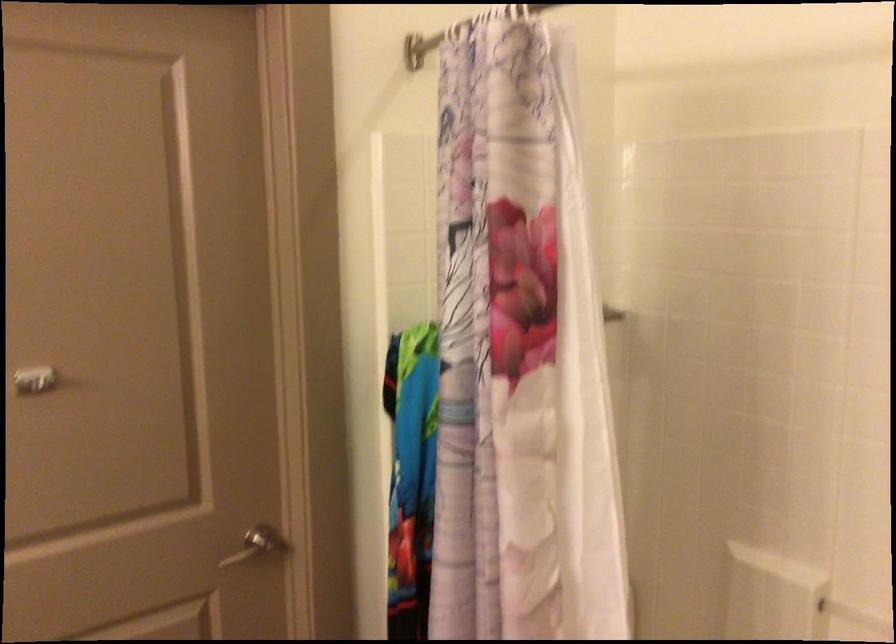
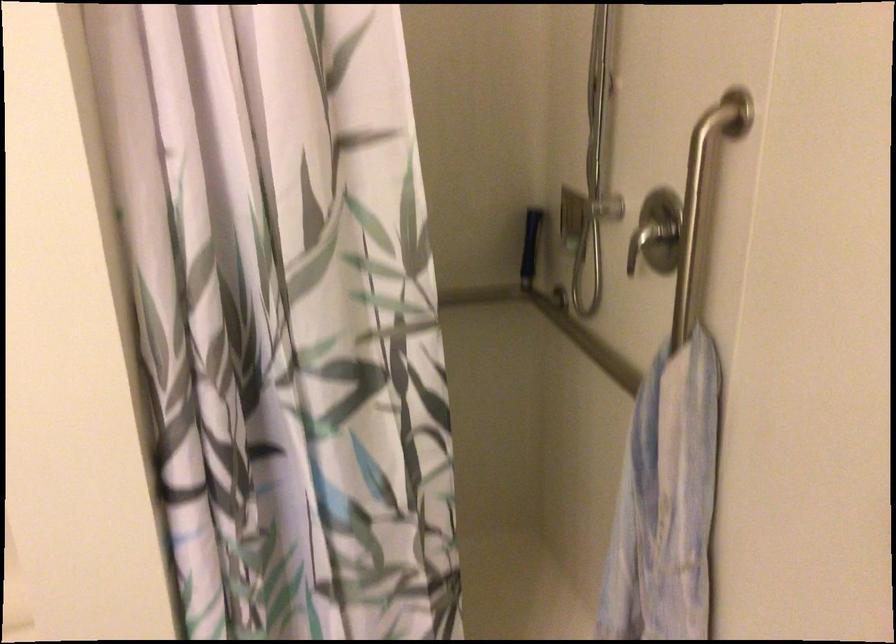
The first image is from the beginning of the video and the second image is from the end. How did the camera likely rotate when shooting the video?

The camera's rotation is toward right-down.